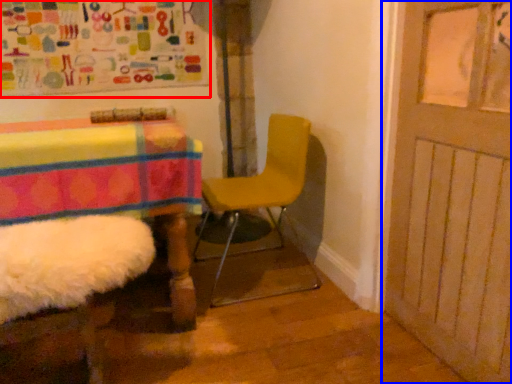
Question: Which of the following is the closest to the observer, bulletin board (highlighted by a red box) or door (highlighted by a blue box)?

Choices:
 (A) bulletin board
 (B) door

Answer: (B)